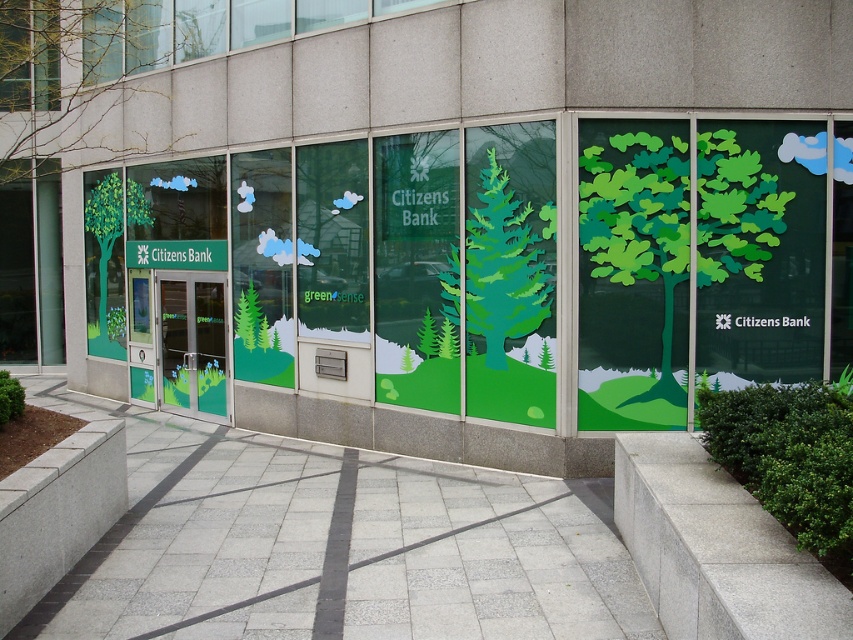
You are standing in front of the Citizens Bank branch and notice two points marked on the facade. The first point is at coordinate point (119, 84) and the second is at point (105, 220). Which point is closer to your current position?

Point (119, 84) is closer to the camera than point (105, 220), so the first point is closer to your current position.

You are standing in front of the Citizens Bank branch and see the green paper tree at right and the green matte tree at left. Which one is located to the right of the other?

The green paper tree at right is positioned on the right side of the green matte tree at left.

What are the coordinates of the green matte tree at upper left?

The green matte tree at upper left is located at coordinates point (67, 81).